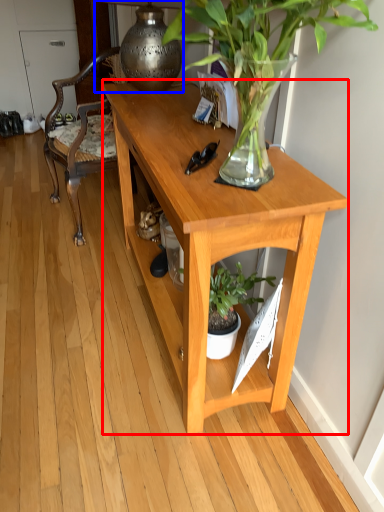
Question: Which of the following is the farthest to the observer, desk (highlighted by a red box) or lamp (highlighted by a blue box)?

Choices:
 (A) desk
 (B) lamp

Answer: (B)